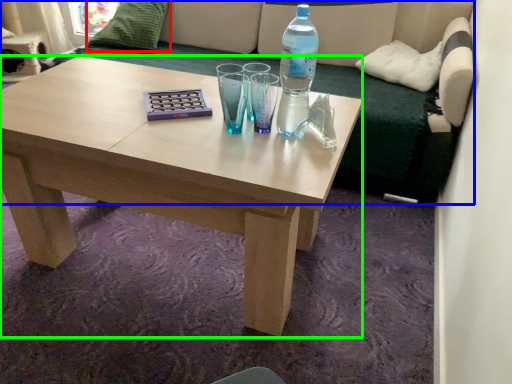
Question: Considering the real-world distances, which object is closest to pillow (highlighted by a red box)? studio couch (highlighted by a blue box) or coffee table (highlighted by a green box).

Choices:
 (A) studio couch
 (B) coffee table

Answer: (A)